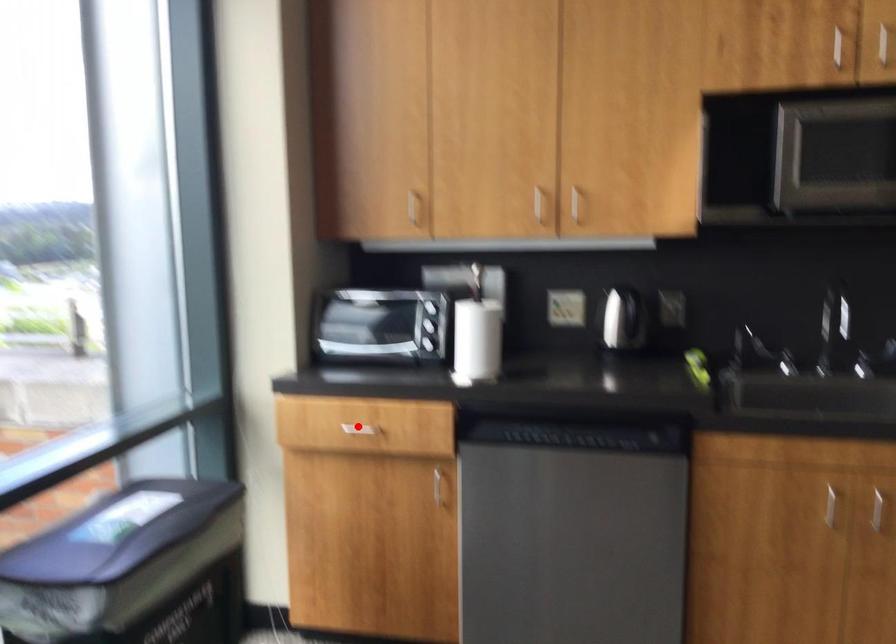
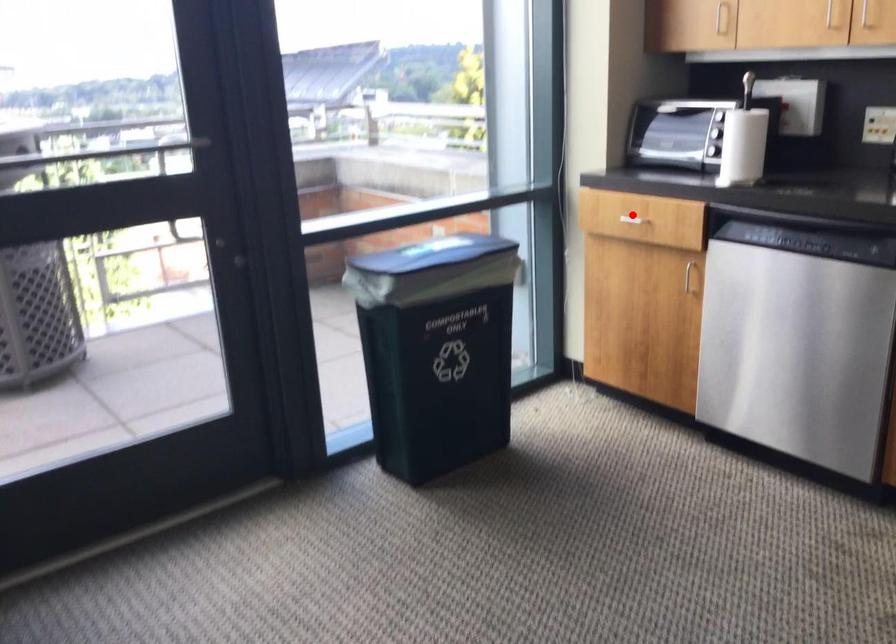
I am providing you with two images of the same scene from different viewpoints. A red point is marked on the first image and another point is marked on the second image. Is the marked point in image1 the same physical position as the marked point in image2?

Yes